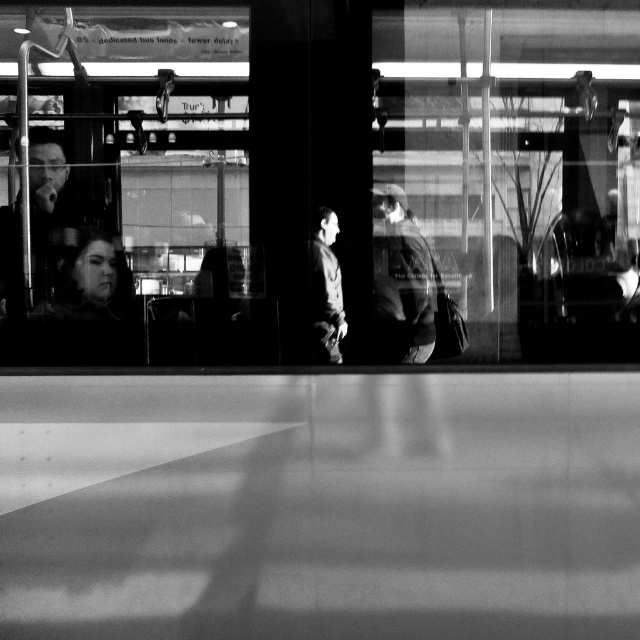
Question: Is dark fabric jacket at center wider than dark gray jacket at center?

Choices:
 (A) yes
 (B) no

Answer: (A)

Question: Observing the image, what is the correct spatial positioning of dark fabric jacket at center in reference to dark gray jacket at center?

Choices:
 (A) left
 (B) right

Answer: (B)

Question: Is the position of dark fabric jacket at center more distant than that of dark gray jacket at center?

Choices:
 (A) yes
 (B) no

Answer: (A)

Question: Which object is farther from the camera taking this photo?

Choices:
 (A) dark gray jacket at center
 (B) dark fabric jacket at center

Answer: (B)